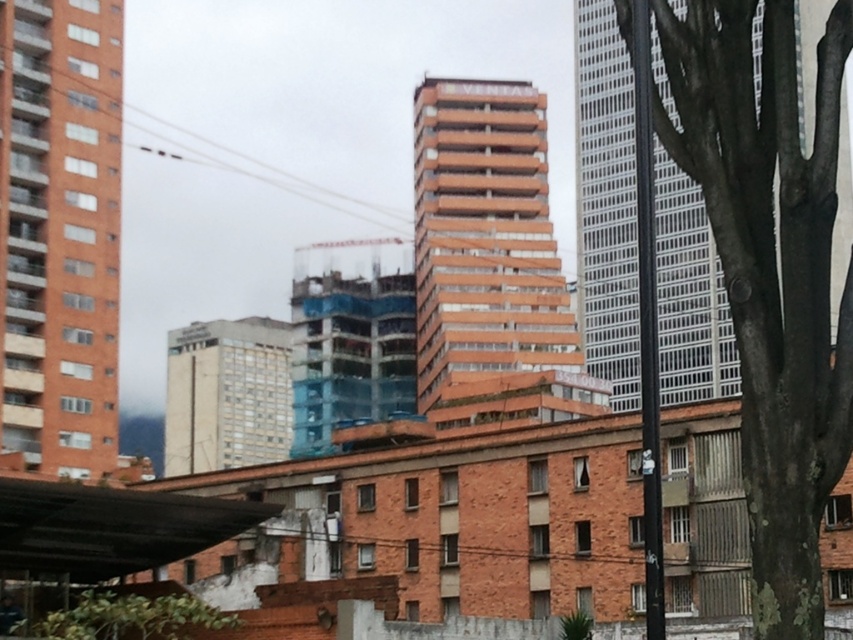
You are standing at the center of the image. Which direction should you move to reach the metallic silver pole at right?

The metallic silver pole at right is located at coordinates 0.503 on the x and 0.760 on the y. Since you are at the center, moving towards the right and slightly upwards would bring you closer to the pole.

You are a city planner assessing the urban greenery. Given the space constraints, you need to determine if the green rough bark tree at right can be transplanted to the location currently occupied by the green leafy tree at lower left. Based on their widths, will this be feasible?

The green rough bark tree at right is wider than the green leafy tree at lower left. Since the current location of the green leafy tree at lower left is narrower, transplanting the larger tree may not be feasible due to space constraints.

You are a city planner assessing the urban space. You need to determine which tree, the green rough bark tree at right or the green leafy tree at lower left, requires more vertical clearance for maintenance equipment. Based on their sizes, which tree would need more space?

The green rough bark tree at right requires more vertical clearance because it is much taller than the green leafy tree at lower left.